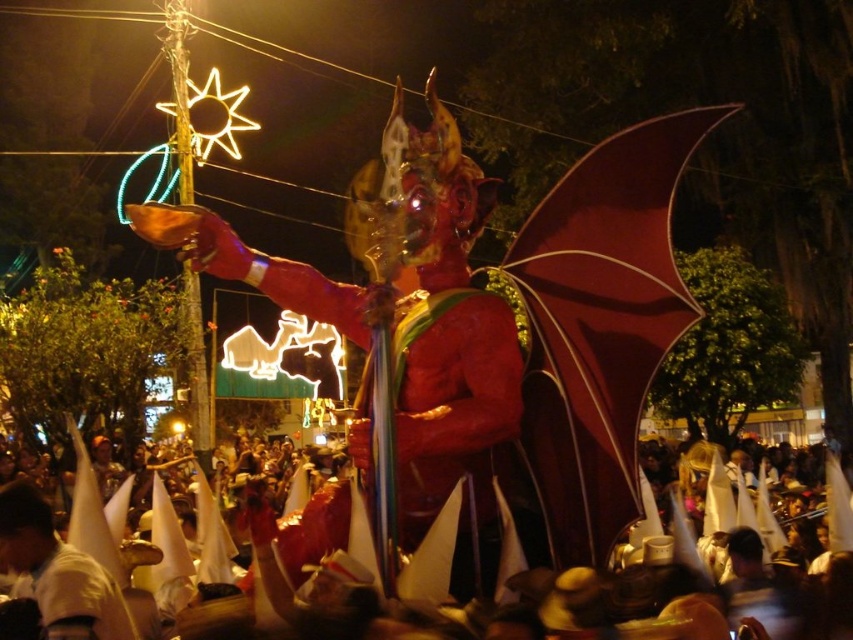
Question: Is white paper hats at center smaller than white matte cone at lower left?

Choices:
 (A) no
 (B) yes

Answer: (A)

Question: Which point appears closest to the camera in this image?

Choices:
 (A) (67, 620)
 (B) (271, 580)

Answer: (A)

Question: Can you confirm if white paper hats at center is bigger than white matte cone at lower left?

Choices:
 (A) yes
 (B) no

Answer: (A)

Question: Does white paper hats at center have a lesser width compared to white matte cone at lower left?

Choices:
 (A) no
 (B) yes

Answer: (A)